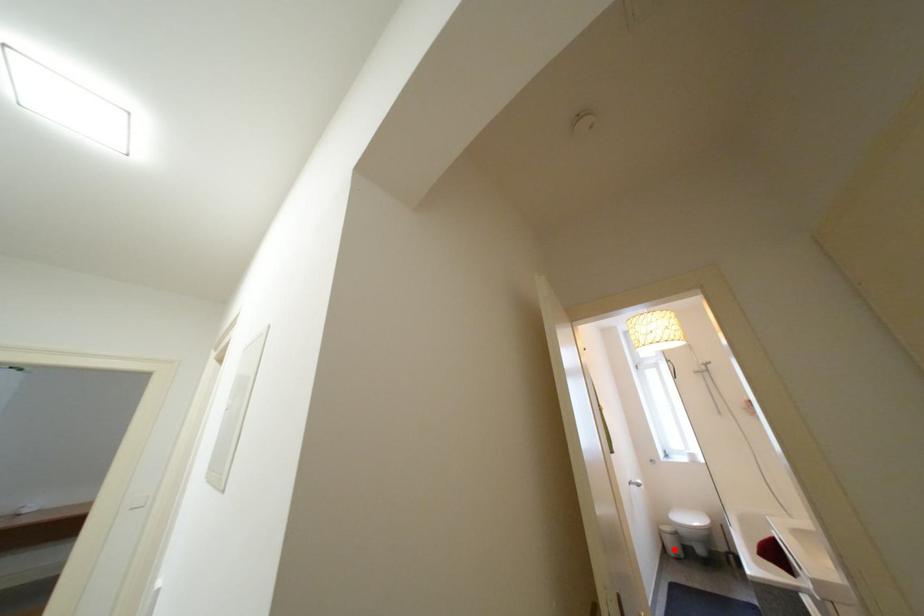
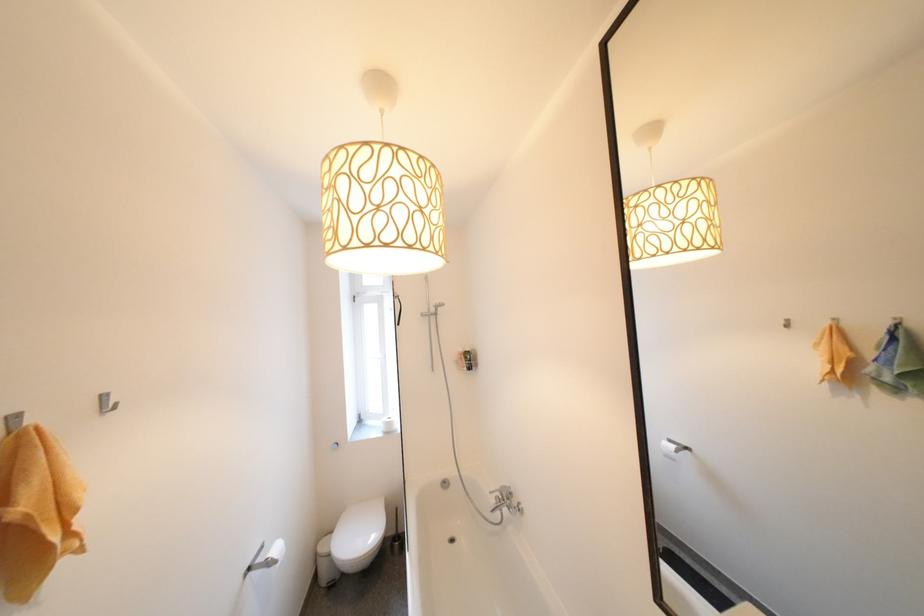
Question: I am providing you with two images of the same scene from different viewpoints. Given a red point in image1, look at the same physical point in image2. Is it:

Choices:
 (A) Closer to the viewpoint
 (B) Farther from the viewpoint

Answer: (B)